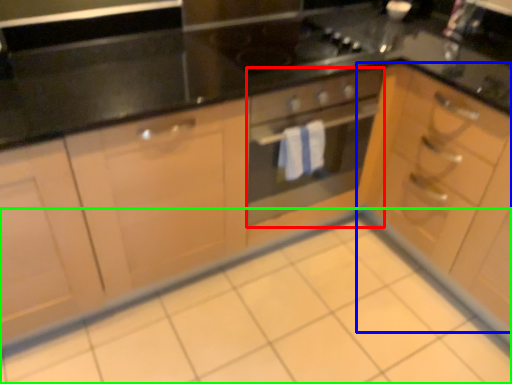
Question: Which is farther away from oven (highlighted by a red box)? cabinetry (highlighted by a blue box) or ceramic tile (highlighted by a green box)?

Choices:
 (A) cabinetry
 (B) ceramic tile

Answer: (B)